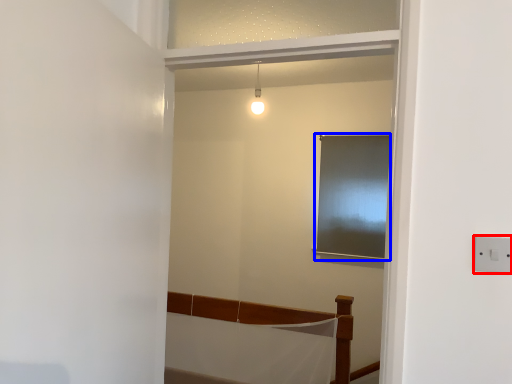
Question: Which object is further to the camera taking this photo, electric outlet (highlighted by a red box) or window (highlighted by a blue box)?

Choices:
 (A) electric outlet
 (B) window

Answer: (B)